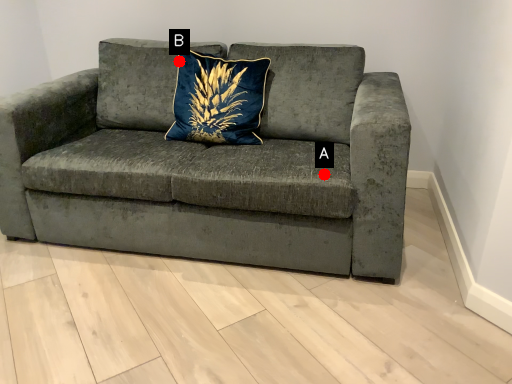
Question: Two points are circled on the image, labeled by A and B beside each circle. Which point is further to the camera?

Choices:
 (A) A is further
 (B) B is further

Answer: (B)